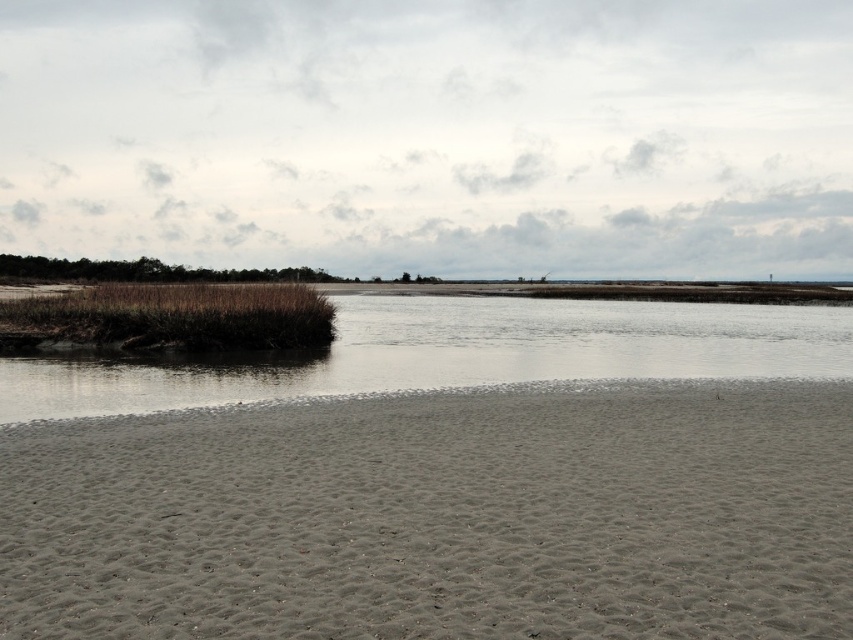
You are standing at the point with coordinates (x=439, y=516). Which object from the scene are you standing on?

You are standing on the gray sandy beach at lower center located at point (x=439, y=516).

You are standing on the gray sandy beach at lower center and want to reach the brown grassy wetland at left. Which direction should you walk to get there?

You should walk towards the left from the gray sandy beach at lower center to reach the brown grassy wetland at left because the gray sandy beach at lower center is closer to the viewer than the brown grassy wetland at left, meaning the wetland is further away and located to the left side of the scene.

You are a hiker who wants to cross the brown grassy wetland at left to reach the brown matte water at center. Based on the scene, is the wetland large enough to require a detour around it?

The brown matte water at center is bigger than brown grassy wetland at left, so the wetland is smaller than the water area. Therefore, the wetland is not large enough to require a detour around it.